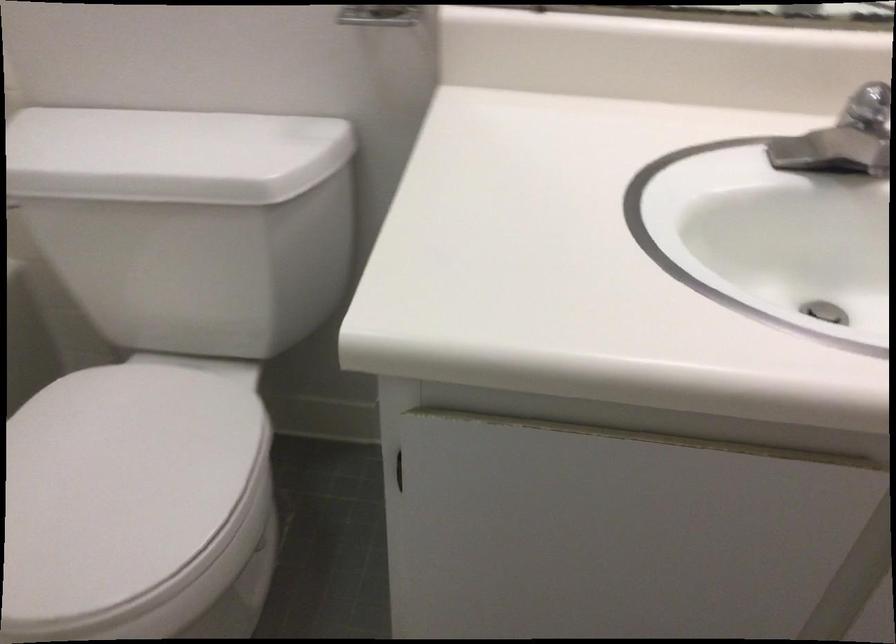
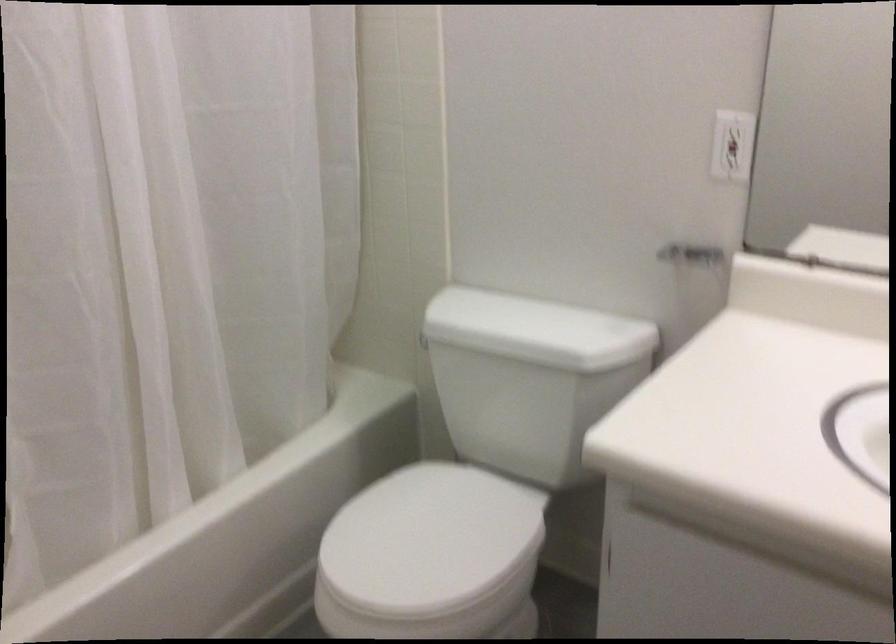
Locate, in the second image, the point that corresponds to the point at 124,494 in the first image.

(429, 540)